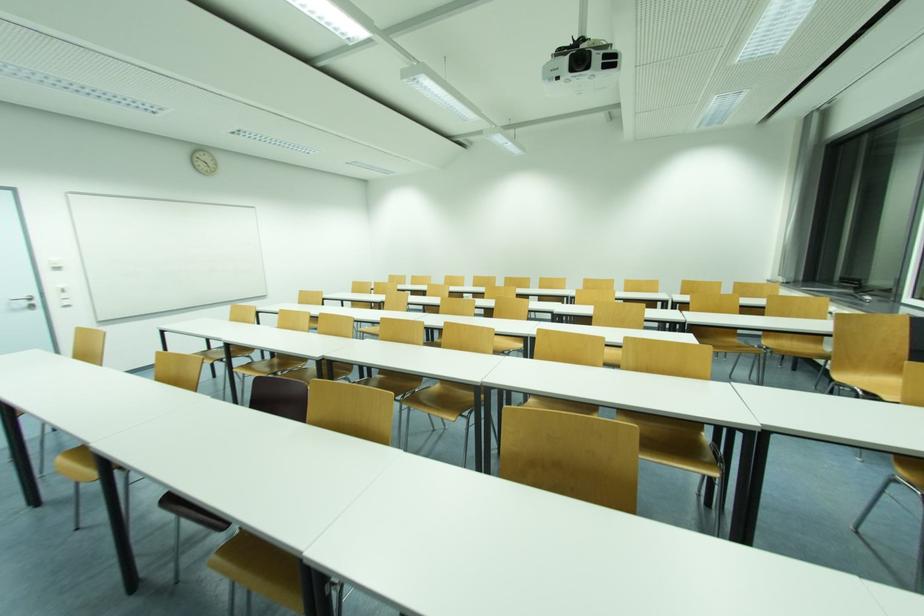
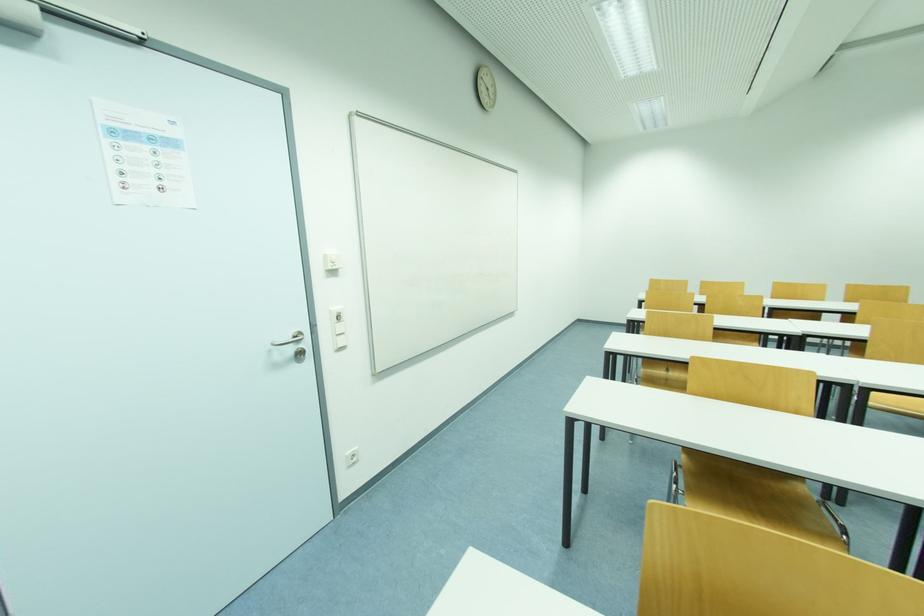
Looking at this image, in a continuous first-person perspective shot, in which direction is the camera moving?

The movement direction of the cameraman is left, forward.